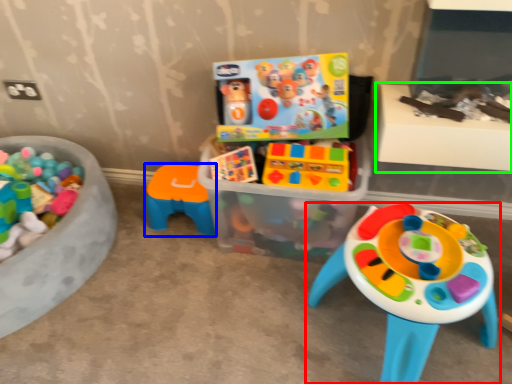
Question: Which is nearer to the toy (highlighted by a red box)? toy (highlighted by a blue box) or table (highlighted by a green box).

Choices:
 (A) toy
 (B) table

Answer: (B)